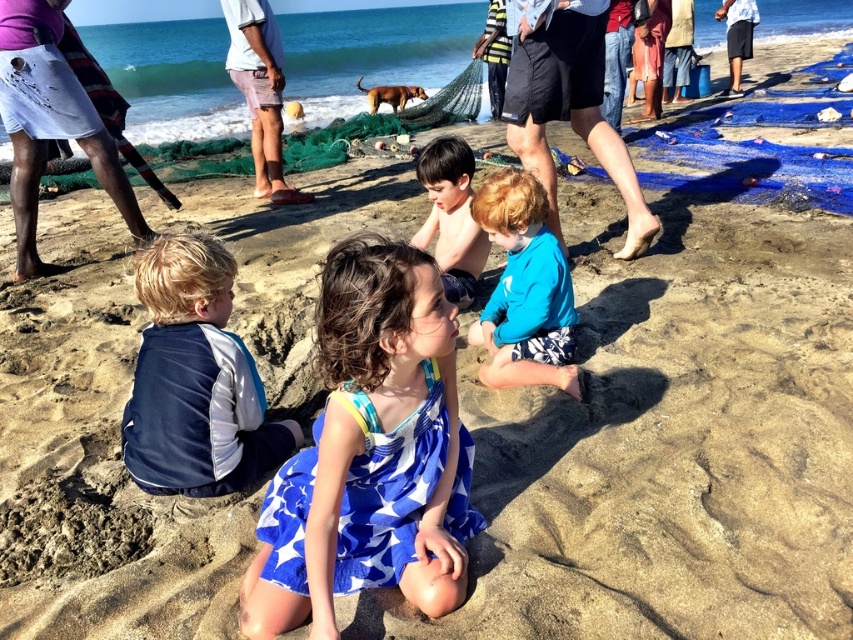
Can you confirm if dark blue shorts at center is wider than white striped skirt at upper left?

No, dark blue shorts at center is not wider than white striped skirt at upper left.

Looking at this image, who is more distant from viewer, (630,173) or (27,244)?

Positioned behind is point (27,244).

Find the location of `dark blue shorts at center`. dark blue shorts at center is located at coordinates (567, 102).

Does blue fabric at center appear on the right side of shiny blue shorts at center?

Yes, blue fabric at center is to the right of shiny blue shorts at center.

Who is positioned more to the right, blue fabric at center or shiny blue shorts at center?

blue fabric at center

Which is in front, point (505, 340) or point (440, 192)?

Positioned in front is point (505, 340).

Locate an element on the screen. Image resolution: width=853 pixels, height=640 pixels. blue fabric at center is located at coordinates (524, 289).

In the scene shown: Measure the distance between white striped skirt at upper left and shiny blue shorts at center.

A distance of 7.56 feet exists between white striped skirt at upper left and shiny blue shorts at center.

Is white striped skirt at upper left positioned before shiny blue shorts at center?

No, white striped skirt at upper left is further to the viewer.

Who is more distant from viewer, (x=125, y=200) or (x=456, y=173)?

Point (x=125, y=200)

Locate an element on the screen. The width and height of the screenshot is (853, 640). white striped skirt at upper left is located at coordinates (49, 122).